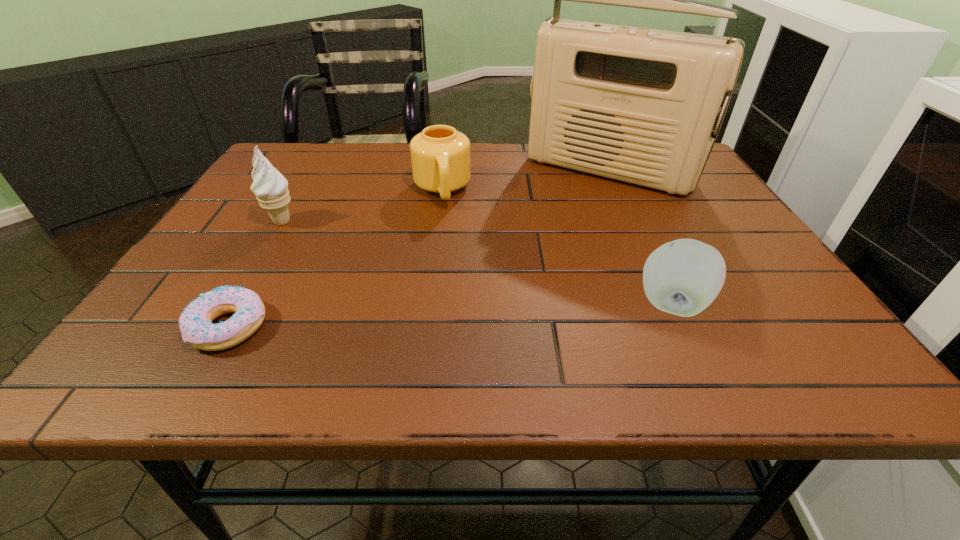
This screenshot has width=960, height=540. In order to click on vacant space at the far left corner of the desktop in this screenshot , I will do `click(300, 168)`.

You are a GUI agent. You are given a task and a screenshot of the screen. Output one action in this format:
    pyautogui.click(x=<x>, y=<y>)
    Task: Click on the vacant space at the near right corner of the desktop
    The image size is (960, 540).
    Given the screenshot: What is the action you would take?
    pyautogui.click(x=758, y=324)

Where is `vacant point located between the third nearest object and the doughnut`? vacant point located between the third nearest object and the doughnut is located at coordinates (255, 274).

Where is `blank region between the radio receiver and the doughnut`? blank region between the radio receiver and the doughnut is located at coordinates (420, 249).

At what (x,y) coordinates should I click in order to perform the action: click on vacant area that lies between the tallest object and the third object from right to left. Please return your answer as a coordinate pair (x, y). Looking at the image, I should click on (525, 180).

Locate an element on the screen. Image resolution: width=960 pixels, height=540 pixels. vacant point located between the tallest object and the shortest object is located at coordinates point(420,249).

Where is `vacant area that lies between the apple and the icecream`? vacant area that lies between the apple and the icecream is located at coordinates [478, 264].

The width and height of the screenshot is (960, 540). Find the location of `vacant area that lies between the third object from left to right and the tallest object`. vacant area that lies between the third object from left to right and the tallest object is located at coordinates (525, 180).

The height and width of the screenshot is (540, 960). In order to click on empty location between the third object from right to left and the icecream in this screenshot , I will do `click(362, 206)`.

Identify the location of empty space that is in between the apple and the mug. (558, 248).